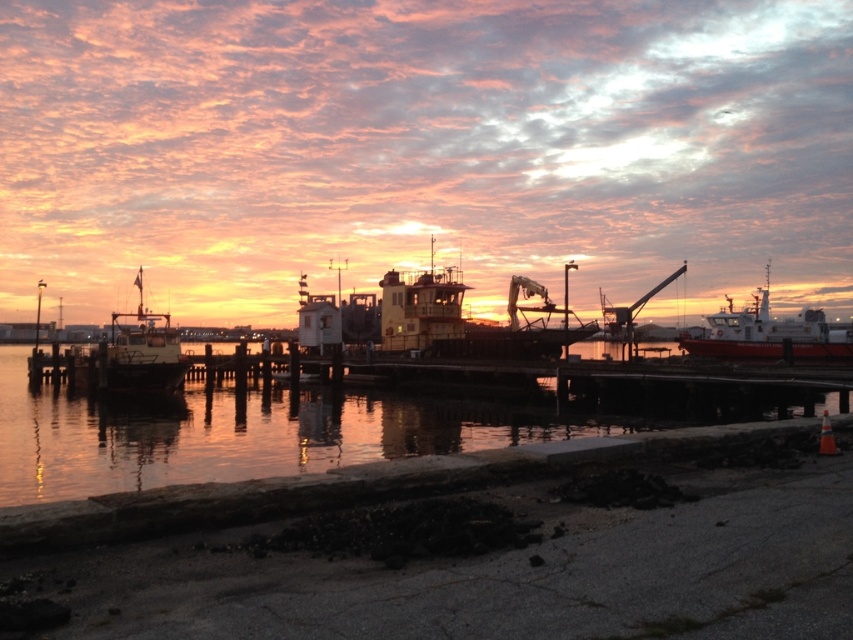
You are a harbor worker who needs to move a 60 feet long cargo container from the yellow matte boat at center to the matte white boat at left. Can you safely transport the cargo container between the two boats without any part of it overlapping?

The yellow matte boat at center and matte white boat at left are 59.56 feet apart from each other. Since the cargo container is 60 feet long, it would overlap by 0.44 feet, making it unsafe to transport without overlapping. Therefore, the cargo container cannot be safely moved between the two boats without overlapping.

You are a photographer planning to capture the sunset reflection on the water. You have a camera with a 50mm lens, which has a field of view that can capture objects up to 3 meters wide. The glossy water at center and the red matte boat at right are both in your frame. Considering their sizes, which object will require you to zoom in more to fully capture its details?

The glossy water at center has a smaller size compared to the red matte boat at right, so to fully capture its details, you would need to zoom in more on the glossy water at center.

You are standing on the walkway and want to take a photo of the red matte boat at right and the glossy water at center. Which object should you focus on first if you want to capture both in one frame without moving your camera?

You should focus on the glossy water at center first because it is positioned to the left of the red matte boat at right, so by framing from left to right, both objects can be included in the shot.